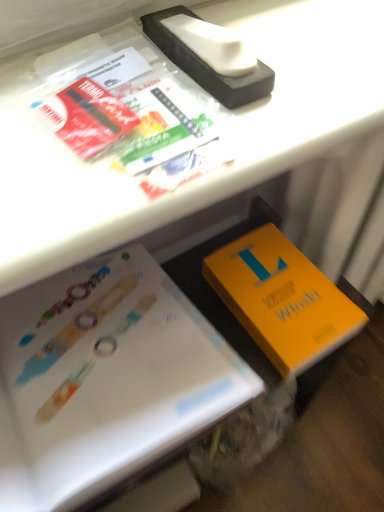
Question: Could you tell me if white paper at lower left, arranged as the first book when viewed from the left, is facing orange matte book at lower right, which is the first book from right to left?

Choices:
 (A) yes
 (B) no

Answer: (B)

Question: Is white paper at lower left, arranged as the first book when viewed from the left, in front of orange matte book at lower right, marked as the 2th book in a left-to-right arrangement?

Choices:
 (A) no
 (B) yes

Answer: (B)

Question: Considering the relative sizes of white paper at lower left, which appears as the 2th book when viewed from the right, and orange matte book at lower right, which is the first book from right to left, in the image provided, is white paper at lower left, which appears as the 2th book when viewed from the right, bigger than orange matte book at lower right, which is the first book from right to left,?

Choices:
 (A) yes
 (B) no

Answer: (A)

Question: From the image's perspective, is white paper at lower left, arranged as the first book when viewed from the left, located beneath orange matte book at lower right, which is the first book from right to left?

Choices:
 (A) yes
 (B) no

Answer: (A)

Question: Is white paper at lower left, which appears as the 2th book when viewed from the right, turned away from orange matte book at lower right, which is the first book from right to left?

Choices:
 (A) yes
 (B) no

Answer: (B)

Question: Is white paper at lower left, arranged as the first book when viewed from the left, smaller than orange matte book at lower right, which is the first book from right to left?

Choices:
 (A) yes
 (B) no

Answer: (B)

Question: Is the depth of orange matte book at lower right, marked as the 2th book in a left-to-right arrangement, greater than that of white paper at lower left, arranged as the first book when viewed from the left?

Choices:
 (A) no
 (B) yes

Answer: (B)

Question: Can you confirm if orange matte book at lower right, which is the first book from right to left, is smaller than white paper at lower left, which appears as the 2th book when viewed from the right?

Choices:
 (A) no
 (B) yes

Answer: (B)

Question: Considering the relative sizes of orange matte book at lower right, which is the first book from right to left, and white paper at lower left, arranged as the first book when viewed from the left, in the image provided, is orange matte book at lower right, which is the first book from right to left, thinner than white paper at lower left, arranged as the first book when viewed from the left,?

Choices:
 (A) no
 (B) yes

Answer: (B)

Question: From the image's perspective, would you say orange matte book at lower right, marked as the 2th book in a left-to-right arrangement, is positioned over white paper at lower left, which appears as the 2th book when viewed from the right?

Choices:
 (A) no
 (B) yes

Answer: (B)

Question: Is orange matte book at lower right, which is the first book from right to left, shorter than white paper at lower left, which appears as the 2th book when viewed from the right?

Choices:
 (A) yes
 (B) no

Answer: (A)

Question: Is orange matte book at lower right, marked as the 2th book in a left-to-right arrangement, facing towards white paper at lower left, which appears as the 2th book when viewed from the right?

Choices:
 (A) yes
 (B) no

Answer: (B)

Question: From a real-world perspective, relative to orange matte book at lower right, which is the first book from right to left, is white paper at lower left, arranged as the first book when viewed from the left, vertically above or below?

Choices:
 (A) above
 (B) below

Answer: (A)